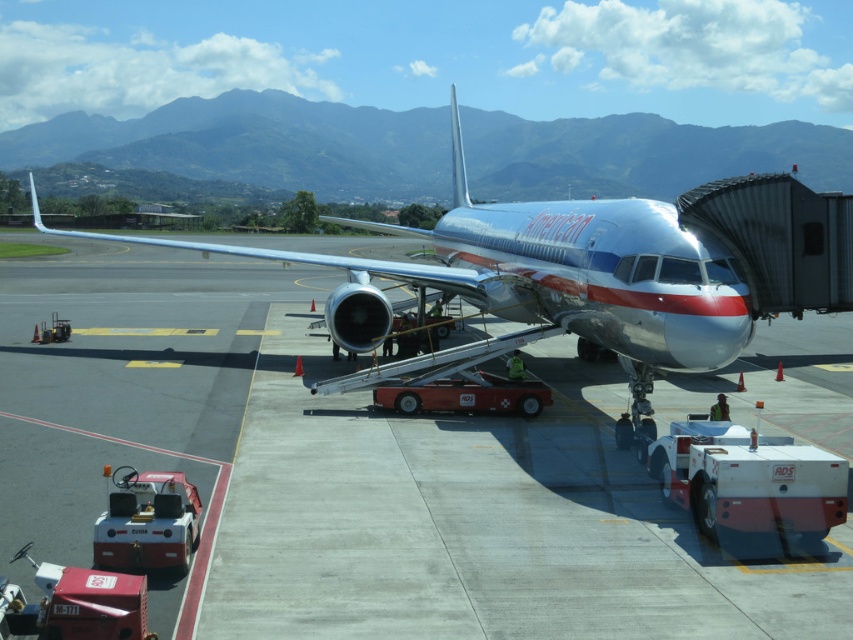
You are a pilot standing on the smooth concrete tarmac at center and looking towards the silver metallic airplane at center. Which object is taller from your perspective?

The silver metallic airplane at center is taller than the smooth concrete tarmac at center.

You are a maintenance worker at the airport. You need to walk from the jet bridge to the tug vehicle. The jet bridge is connected to the silver metallic airplane at center. The tug vehicle is on the left side. Based on the scene description, where should you walk relative to the smooth concrete tarmac at center?

The smooth concrete tarmac at center is located below the silver metallic airplane at center, so to reach the tug vehicle on the left side, you should walk towards the left from the jet bridge, staying on the smooth concrete tarmac at center.

You are standing on the airport tarmac and want to walk from point A to point B. Point A is at point (606, 388) and point B is at point (590, 214). Which point is closer to you when you start walking?

Point A at (606, 388) is closer to you because it is further to the viewer than point B at (590, 214), so you will reach it first.